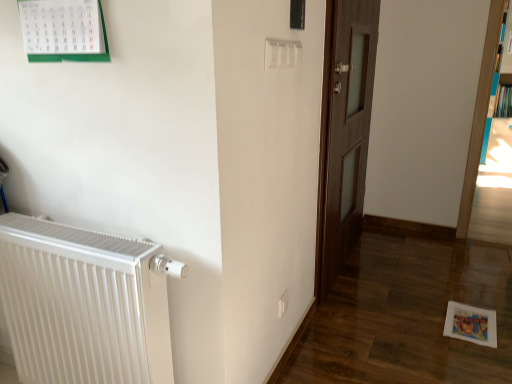
Question: From a real-world perspective, does blue glossy bookcase at right, which is the 1th bookcase in right-to-left order, sit lower than white metallic radiator at left?

Choices:
 (A) no
 (B) yes

Answer: (A)

Question: Is blue glossy bookcase at right, the 2th bookcase viewed from the left, shorter than white metallic radiator at left?

Choices:
 (A) yes
 (B) no

Answer: (B)

Question: Considering the relative sizes of blue glossy bookcase at right, which is the 1th bookcase in right-to-left order, and white metallic radiator at left in the image provided, is blue glossy bookcase at right, which is the 1th bookcase in right-to-left order, bigger than white metallic radiator at left?

Choices:
 (A) yes
 (B) no

Answer: (A)

Question: Considering the relative sizes of blue glossy bookcase at right, the second bookcase when ordered from front to back, and white metallic radiator at left in the image provided, is blue glossy bookcase at right, the second bookcase when ordered from front to back, thinner than white metallic radiator at left?

Choices:
 (A) yes
 (B) no

Answer: (B)

Question: Can you confirm if blue glossy bookcase at right, marked as the 1th bookcase in a back-to-front arrangement, is wider than white metallic radiator at left?

Choices:
 (A) no
 (B) yes

Answer: (B)

Question: Does blue glossy bookcase at right, the 2th bookcase viewed from the left, lie behind white metallic radiator at left?

Choices:
 (A) no
 (B) yes

Answer: (B)

Question: From the image's perspective, would you say wooden bookshelf at right, which is counted as the 1th bookcase, starting from the left, is positioned over white metallic radiator at left?

Choices:
 (A) yes
 (B) no

Answer: (A)

Question: Would you say wooden bookshelf at right, which is counted as the 1th bookcase, starting from the left, contains white metallic radiator at left?

Choices:
 (A) no
 (B) yes

Answer: (A)

Question: Is wooden bookshelf at right, which is counted as the 1th bookcase, starting from the left, at the left side of white metallic radiator at left?

Choices:
 (A) yes
 (B) no

Answer: (B)

Question: Is wooden bookshelf at right, which is counted as the 1th bookcase, starting from the left, far away from white metallic radiator at left?

Choices:
 (A) no
 (B) yes

Answer: (B)

Question: Is wooden bookshelf at right, which is counted as the 2th bookcase, starting from the back, outside of white metallic radiator at left?

Choices:
 (A) yes
 (B) no

Answer: (A)

Question: Is wooden bookshelf at right, which is counted as the 2th bookcase, starting from the back, further to the viewer compared to white metallic radiator at left?

Choices:
 (A) yes
 (B) no

Answer: (A)

Question: From the image's perspective, is dark wood door at center over hardcover book at upper right?

Choices:
 (A) yes
 (B) no

Answer: (B)